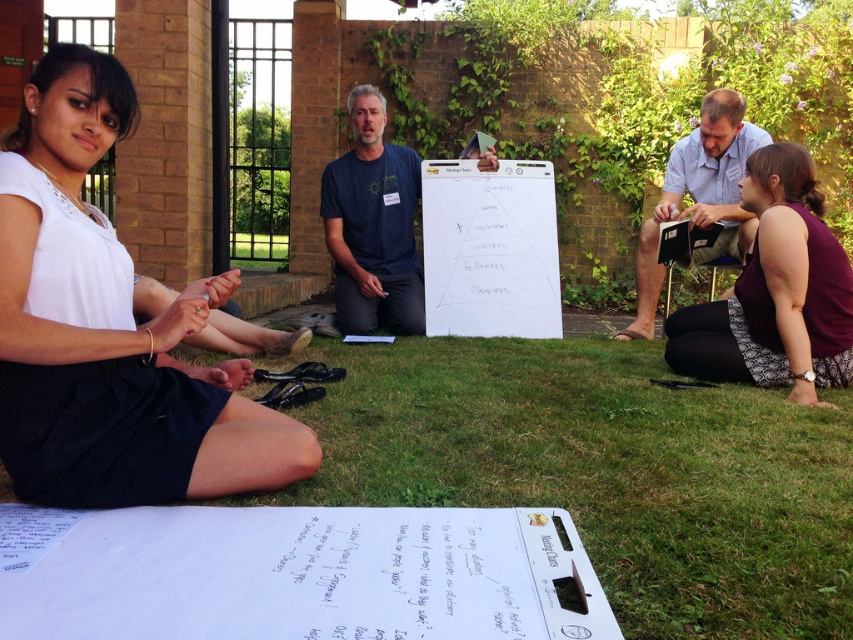
You are a photographer trying to capture a photo of both the white fabric skirt at lower left and the purple fabric shirt at lower right. Since you want to ensure both are fully visible in the frame, which clothing item should you focus on first to adjust your camera angle?

The white fabric skirt at lower left is much taller than the purple fabric shirt at lower right. To ensure both are fully visible, focus on adjusting the camera angle for the white fabric skirt at lower left first because it is taller and might require more vertical space in the frame.

You are standing in the garden and see the white fabric skirt at lower left. If you want to pick up a pen from your pocket and write on the poster, can you reach the poster without moving closer to the skirt?

The distance between you and the white fabric skirt at lower left is 4.75 feet. Since the poster is in the foreground near the skirt, you are already close enough to reach it without needing to move closer.

You are a photographer trying to capture the scene from the lower center. You need to ensure that both the white fabric skirt at lower left and the matte black clipboard at lower right are fully visible in your shot. Based on their positions and sizes, do you think they will both fit within the frame?

The white fabric skirt at lower left might be wider than matte black clipboard at lower right, so there is a possibility that the skirt could take up more space in the frame. However, since both are positioned at the lower edges of the scene, it is likely they can both be included if the camera angle is adjusted appropriately to accommodate their widths.